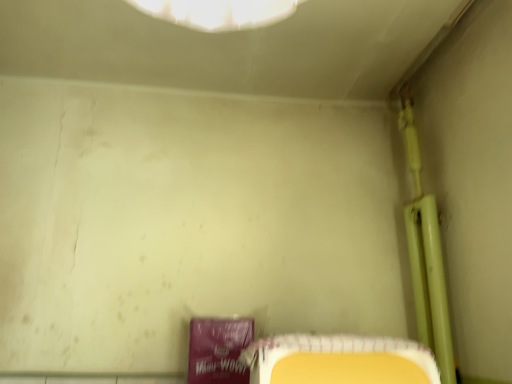
Where is `green matte pipe at upper right`? green matte pipe at upper right is located at coordinates (426, 253).

What do you see at coordinates (426, 253) in the screenshot? I see `green matte pipe at upper right` at bounding box center [426, 253].

At what (x,y) coordinates should I click in order to perform the action: click on yellow plastic tray at lower right. Please return your answer as a coordinate pair (x, y). Image resolution: width=512 pixels, height=384 pixels. Looking at the image, I should click on (338, 360).

The width and height of the screenshot is (512, 384). Describe the element at coordinates (338, 360) in the screenshot. I see `yellow plastic tray at lower right` at that location.

The width and height of the screenshot is (512, 384). Identify the location of green matte pipe at upper right. (426, 253).

Can you confirm if yellow plastic tray at lower right is positioned to the left of green matte pipe at upper right?

Indeed, yellow plastic tray at lower right is positioned on the left side of green matte pipe at upper right.

Considering their positions, is yellow plastic tray at lower right located in front of or behind green matte pipe at upper right?

yellow plastic tray at lower right is positioned closer to the viewer than green matte pipe at upper right.

Considering the points (296, 336) and (407, 127), which point is behind, point (296, 336) or point (407, 127)?

The point (407, 127) is more distant.

From the image's perspective, would you say yellow plastic tray at lower right is positioned over green matte pipe at upper right?

No, from the image's perspective, yellow plastic tray at lower right is not on top of green matte pipe at upper right.

From a real-world perspective, is yellow plastic tray at lower right positioned above or below green matte pipe at upper right?

Clearly, from a real-world perspective, yellow plastic tray at lower right is below green matte pipe at upper right.

Between yellow plastic tray at lower right and green matte pipe at upper right, which one has larger width?

yellow plastic tray at lower right.

Looking at this image, considering the sizes of objects yellow plastic tray at lower right and green matte pipe at upper right in the image provided, who is shorter, yellow plastic tray at lower right or green matte pipe at upper right?

Standing shorter between the two is yellow plastic tray at lower right.

Considering the sizes of yellow plastic tray at lower right and green matte pipe at upper right in the image, is yellow plastic tray at lower right bigger or smaller than green matte pipe at upper right?

In the image, yellow plastic tray at lower right appears to be smaller than green matte pipe at upper right.

Is yellow plastic tray at lower right surrounding green matte pipe at upper right?

Definitely not — green matte pipe at upper right is not inside yellow plastic tray at lower right.

Is yellow plastic tray at lower right beside green matte pipe at upper right?

yellow plastic tray at lower right and green matte pipe at upper right are not in contact.

Does yellow plastic tray at lower right turn towards green matte pipe at upper right?

No, yellow plastic tray at lower right is not aimed at green matte pipe at upper right.

How many degrees apart are the facing directions of yellow plastic tray at lower right and green matte pipe at upper right?

The angular difference between yellow plastic tray at lower right and green matte pipe at upper right is 88.5 degrees.

How distant is yellow plastic tray at lower right from green matte pipe at upper right?

yellow plastic tray at lower right and green matte pipe at upper right are 22.49 inches apart.

Find the location of a particular element. The image size is (512, 384). furniture in front of the green matte pipe at upper right is located at coordinates (338, 360).

Considering the relative positions of green matte pipe at upper right and yellow plastic tray at lower right in the image provided, is green matte pipe at upper right to the left of yellow plastic tray at lower right from the viewer's perspective?

No.

Is green matte pipe at upper right positioned before yellow plastic tray at lower right?

No, it is not.

Does point (414, 127) come in front of point (289, 358)?

No, it is not.

From the image's perspective, which one is positioned higher, green matte pipe at upper right or yellow plastic tray at lower right?

green matte pipe at upper right, from the image's perspective.

From a real-world perspective, is green matte pipe at upper right under yellow plastic tray at lower right?

No, from a real-world perspective, green matte pipe at upper right is not under yellow plastic tray at lower right.

Based on the photo, considering the relative sizes of green matte pipe at upper right and yellow plastic tray at lower right in the image provided, is green matte pipe at upper right wider than yellow plastic tray at lower right?

No, green matte pipe at upper right is not wider than yellow plastic tray at lower right.

Considering the sizes of green matte pipe at upper right and yellow plastic tray at lower right in the image, is green matte pipe at upper right taller or shorter than yellow plastic tray at lower right?

Clearly, green matte pipe at upper right is taller compared to yellow plastic tray at lower right.

Considering the relative sizes of green matte pipe at upper right and yellow plastic tray at lower right in the image provided, is green matte pipe at upper right bigger than yellow plastic tray at lower right?

Correct, green matte pipe at upper right is larger in size than yellow plastic tray at lower right.

Is green matte pipe at upper right positioned beyond the bounds of yellow plastic tray at lower right?

green matte pipe at upper right lies outside yellow plastic tray at lower right's area.

Is green matte pipe at upper right placed right next to yellow plastic tray at lower right?

green matte pipe at upper right is not next to yellow plastic tray at lower right, and they're not touching.

Is green matte pipe at upper right looking in the opposite direction of yellow plastic tray at lower right?

No, green matte pipe at upper right is not facing away from yellow plastic tray at lower right.

This screenshot has width=512, height=384. Identify the location of furniture below the green matte pipe at upper right (from a real-world perspective). (338, 360).

Find the location of a particular element. The image size is (512, 384). furniture lying on the left of green matte pipe at upper right is located at coordinates (338, 360).

Where is `furniture located in front of the green matte pipe at upper right`? The image size is (512, 384). furniture located in front of the green matte pipe at upper right is located at coordinates (338, 360).